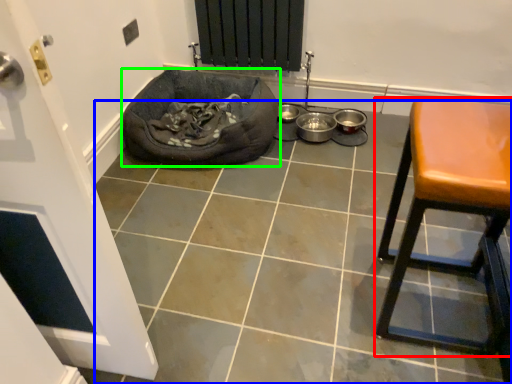
Question: Based on their relative distances, which object is nearer to furniture (highlighted by a red box)? Choose from tile (highlighted by a blue box) and dog bed (highlighted by a green box).

Choices:
 (A) tile
 (B) dog bed

Answer: (A)